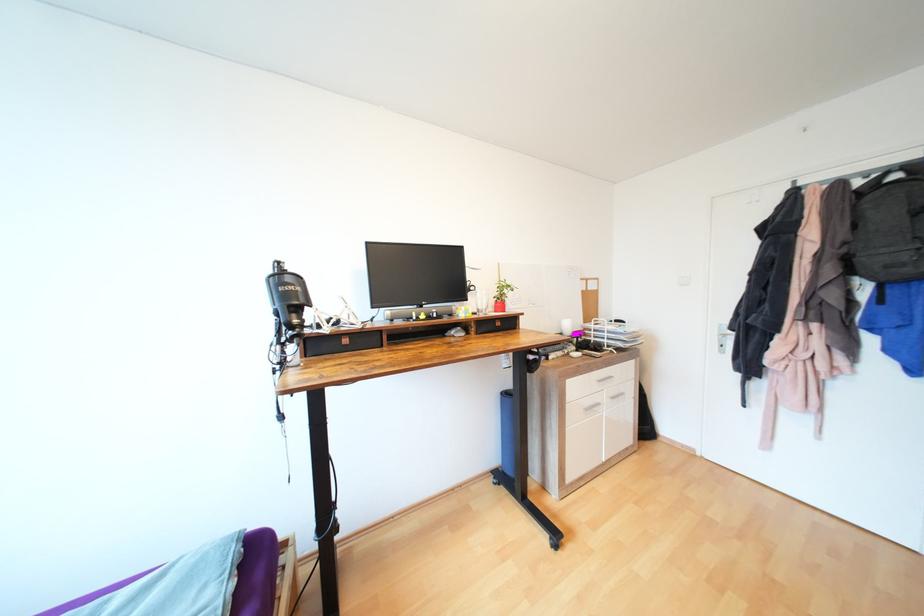
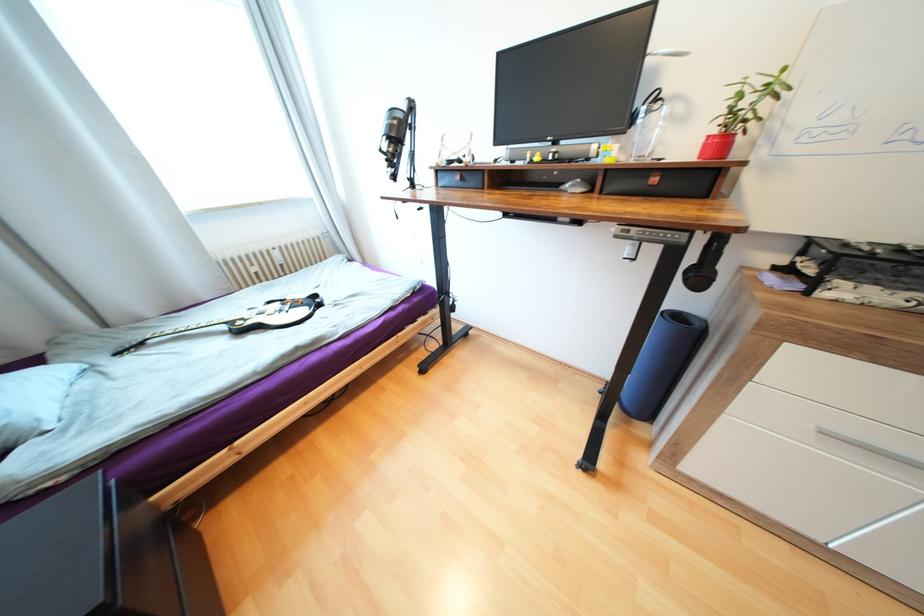
Where in the second image is the point corresponding to point (458, 333) from the first image?

(574, 185)